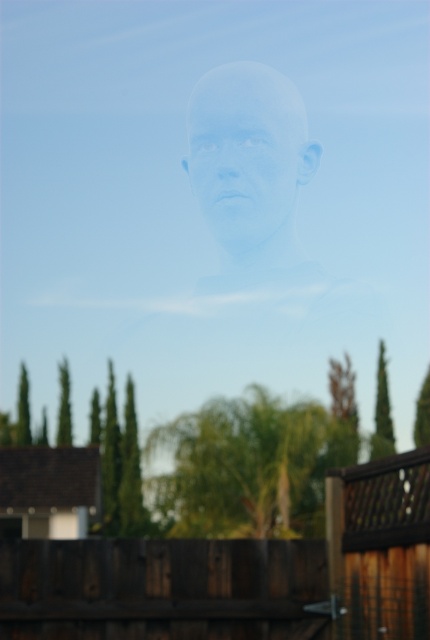
Can you confirm if brown wooden fence at lower center is positioned below translucent plastic head at center?

Correct, brown wooden fence at lower center is located below translucent plastic head at center.

Is brown wooden fence at lower center shorter than translucent plastic head at center?

Indeed, brown wooden fence at lower center has a lesser height compared to translucent plastic head at center.

Is point (178, 541) positioned after point (321, 292)?

No, it is in front of (321, 292).

Where is `brown wooden fence at lower center`? The width and height of the screenshot is (430, 640). brown wooden fence at lower center is located at coordinates (159, 588).

Between point (242, 140) and point (295, 140), which one is positioned in front?

Point (295, 140)

Is point (283, 257) positioned behind point (291, 180)?

No.

Is point (221, 179) behind point (289, 202)?

Yes, it is.

At what (x,y) coordinates should I click in order to perform the action: click on translucent plastic head at center. Please return your answer as a coordinate pair (x, y). Looking at the image, I should click on (254, 180).

Is brown wooden fence at lower center taller than translucent white head at center?

No.

Is point (88, 570) more distant than point (242, 140)?

No, (88, 570) is in front of (242, 140).

This screenshot has width=430, height=640. Find the location of `brown wooden fence at lower center`. brown wooden fence at lower center is located at coordinates (159, 588).

Locate an element on the screen. This screenshot has height=640, width=430. brown wooden fence at lower center is located at coordinates (159, 588).